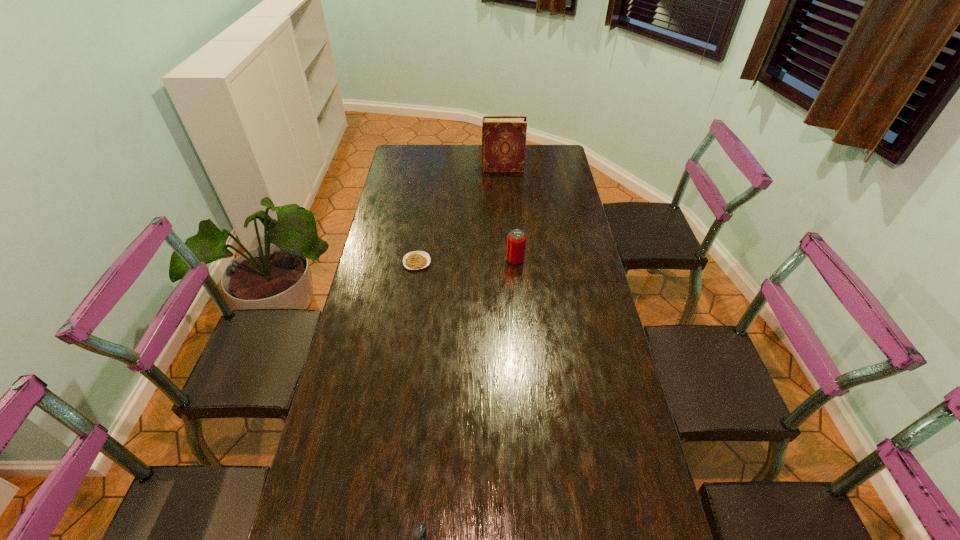
Locate an element on the screen. the farthest object is located at coordinates (503, 137).

Where is `hardback book`? This screenshot has height=540, width=960. hardback book is located at coordinates (503, 137).

What are the coordinates of `the second tallest object` in the screenshot? It's located at (516, 240).

Identify the location of the third tallest object. The width and height of the screenshot is (960, 540). (414, 260).

Locate an element on the screen. the leftmost object is located at coordinates (414, 260).

Find the location of a particular element. The image size is (960, 540). blank area located 0.290m on the spine side of the tallest object is located at coordinates (420, 169).

The width and height of the screenshot is (960, 540). In order to click on vacant space positioned on the spine side of the tallest object in this screenshot , I will do `click(468, 169)`.

Where is `free region located 0.080m on the spine side of the tallest object`? free region located 0.080m on the spine side of the tallest object is located at coordinates (465, 169).

The width and height of the screenshot is (960, 540). Identify the location of blank space located on the left of the can. (425, 260).

Where is `free point located on the front of the second shortest object`? The width and height of the screenshot is (960, 540). free point located on the front of the second shortest object is located at coordinates (414, 284).